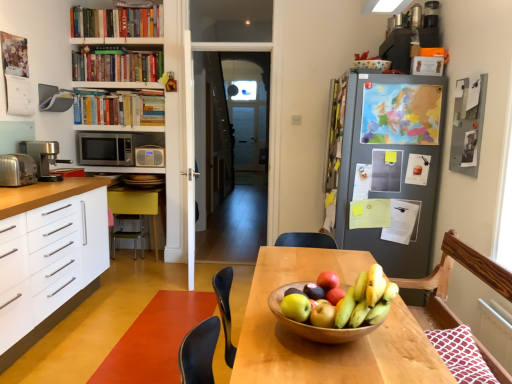
Locate an element on the screen. This screenshot has width=512, height=384. empty space that is ontop of rubberized vinyl floor at lower center (from a real-world perspective) is located at coordinates (158, 326).